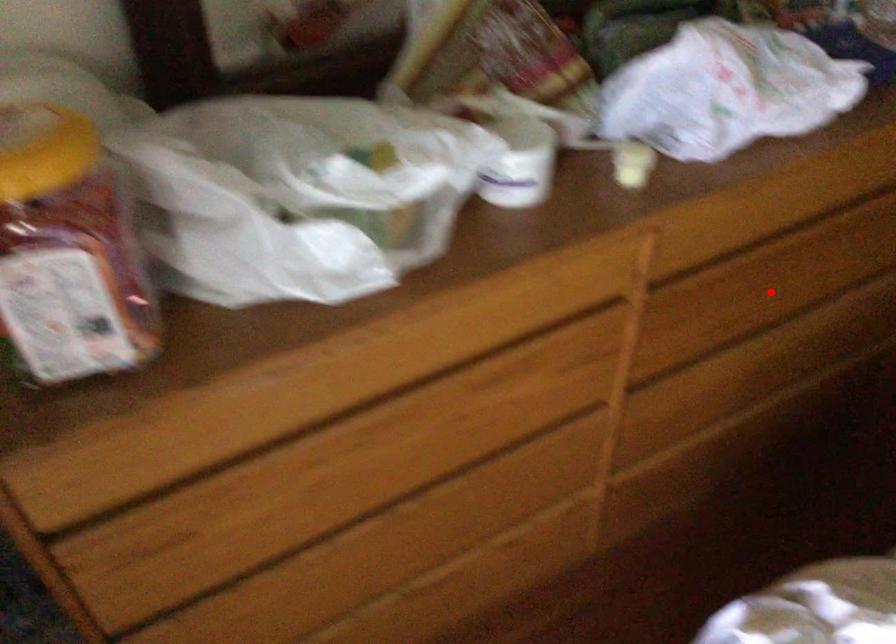
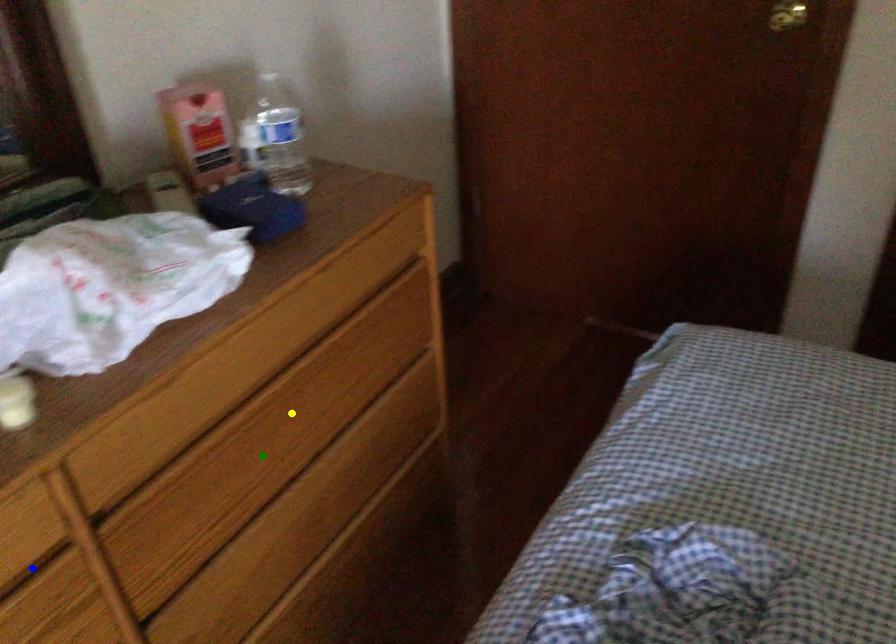
Question: I am providing you with two images of the same scene from different viewpoints. A red point is marked on the first image. You are given multiple points on the second image. Which mark in image 2 goes with the point in image 1?

Choices:
 (A) yellow point
 (B) blue point
 (C) green point

Answer: (C)